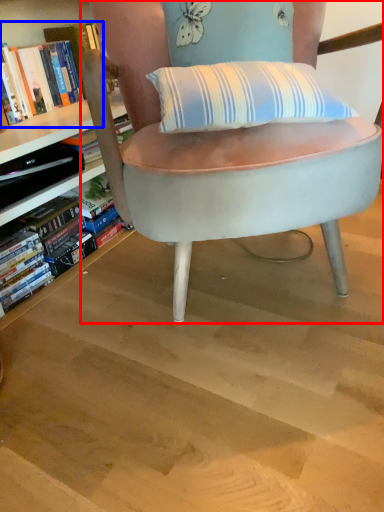
Question: Which object is closer to the camera taking this photo, chair (highlighted by a red box) or book (highlighted by a blue box)?

Choices:
 (A) chair
 (B) book

Answer: (A)